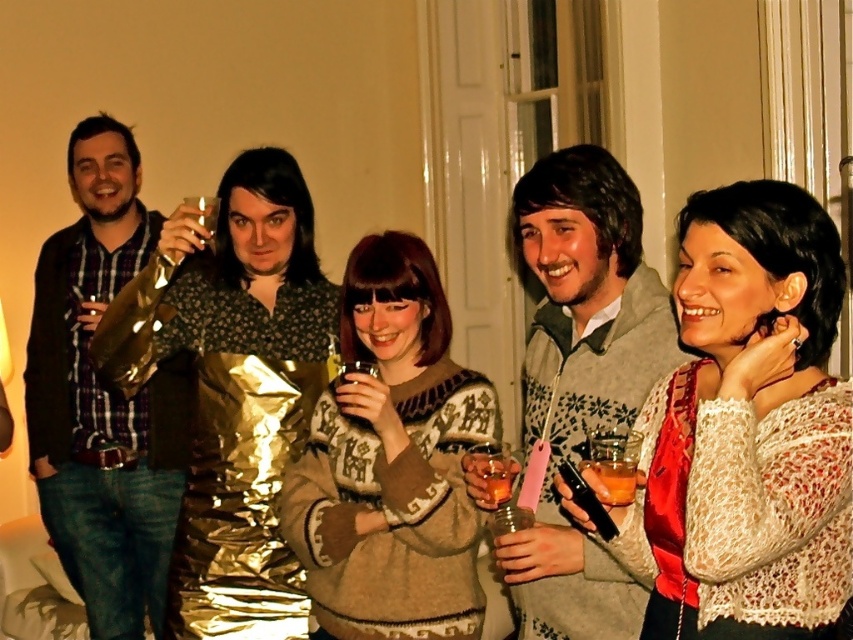
Between matte black shirt at left and translucent amber glass at lower right, which one has more height?

matte black shirt at left is taller.

Where is `matte black shirt at left`? The width and height of the screenshot is (853, 640). matte black shirt at left is located at coordinates (103, 400).

The image size is (853, 640). In order to click on matte black shirt at left in this screenshot , I will do `click(103, 400)`.

Is gray sweater at center smaller than translucent amber glass at lower right?

Actually, gray sweater at center might be larger than translucent amber glass at lower right.

You are a GUI agent. You are given a task and a screenshot of the screen. Output one action in this format:
    pyautogui.click(x=<x>, y=<y>)
    Task: Click on the gray sweater at center
    
    Given the screenshot: What is the action you would take?
    pyautogui.click(x=579, y=380)

Is matte black shirt at left wider than gray sweater at center?

Yes, matte black shirt at left is wider than gray sweater at center.

Is matte black shirt at left bigger than gray sweater at center?

Yes.

Who is more distant from viewer, (109,579) or (590,310)?

Positioned behind is point (109,579).

Identify the location of matte black shirt at left. The image size is (853, 640). (103, 400).